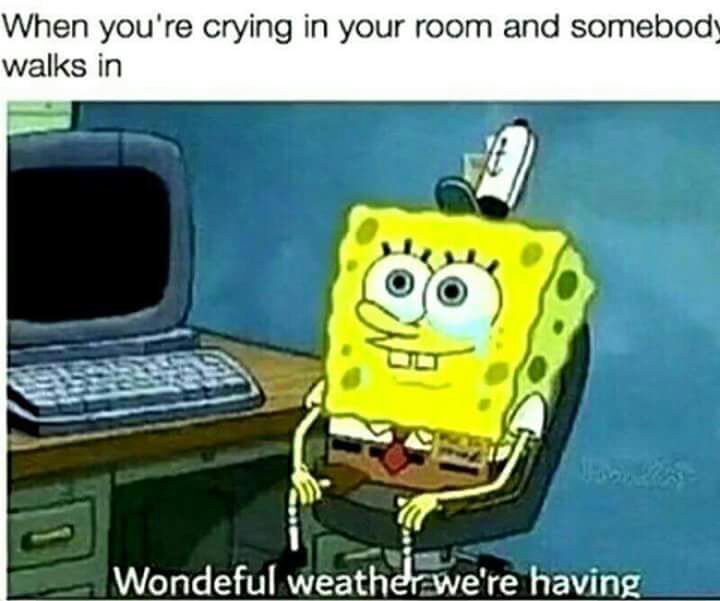
At what (x,y) coordinates should I click in order to perform the action: click on keyboard. Please return your answer as a coordinate pair (x, y). This screenshot has height=601, width=720. Looking at the image, I should click on (126, 383).